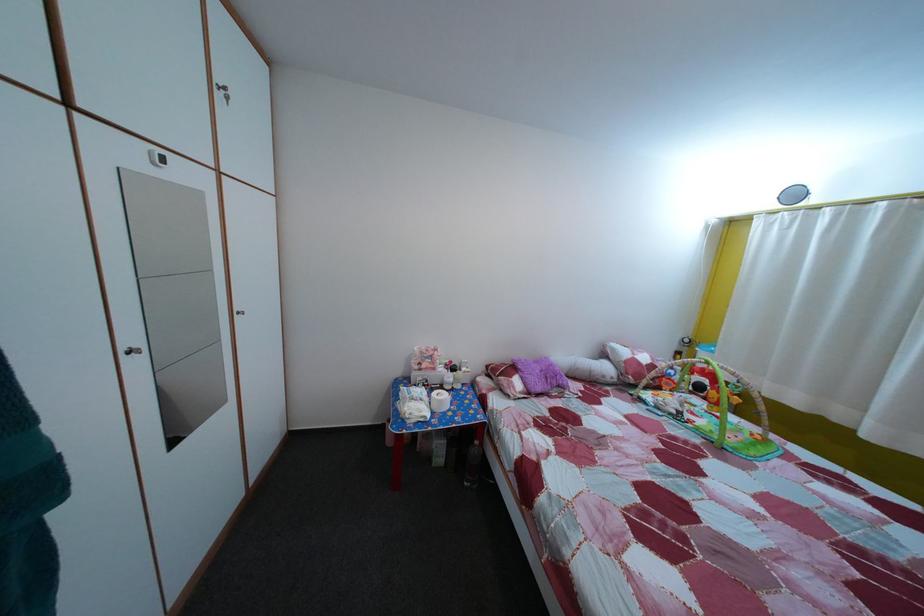
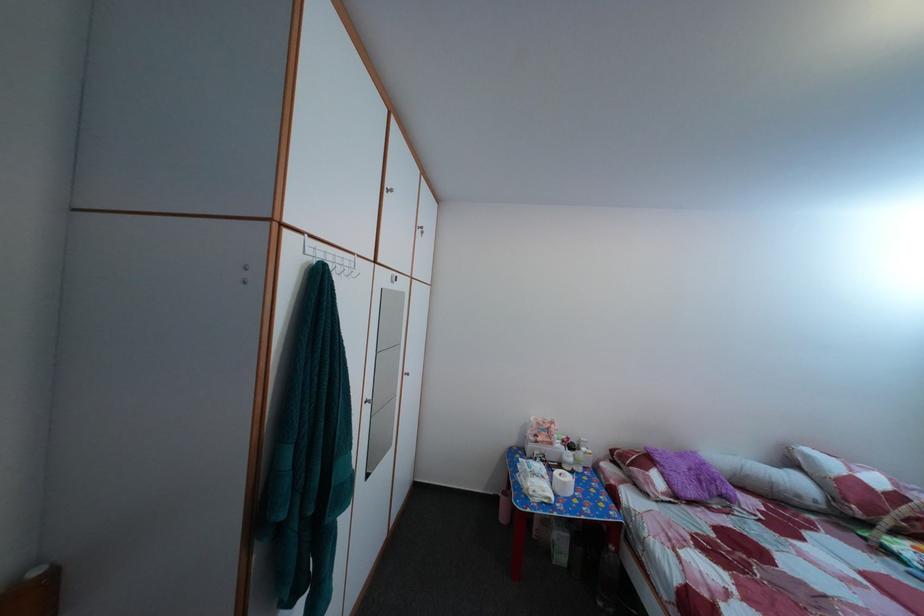
Find the pixel in the second image that matches point 459,370 in the first image.

(578, 447)